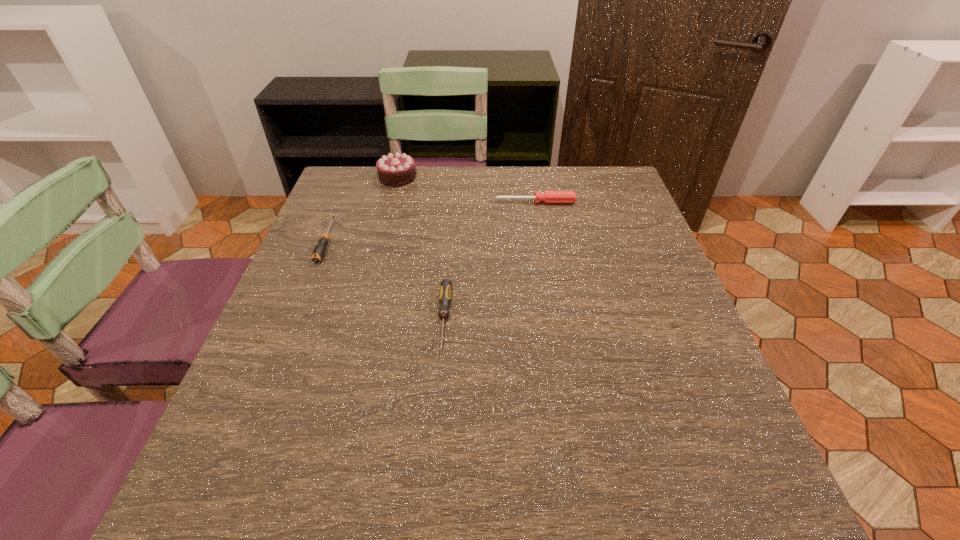
I want to click on chocolate cake, so click(394, 170).

Locate an element on the screen. This screenshot has height=540, width=960. the tallest object is located at coordinates (394, 170).

Find the location of a particular element. This screenshot has width=960, height=540. the rightmost screwdriver is located at coordinates (549, 196).

You are a GUI agent. You are given a task and a screenshot of the screen. Output one action in this format:
    pyautogui.click(x=<x>, y=<y>)
    Task: Click on the rightmost object
    
    Given the screenshot: What is the action you would take?
    pyautogui.click(x=549, y=196)

Locate an element on the screen. The height and width of the screenshot is (540, 960). the second nearest object is located at coordinates (319, 250).

Identify the location of the leftmost object. (319, 250).

Where is `the nearest object`? The image size is (960, 540). the nearest object is located at coordinates (446, 285).

Where is `the second object from right to left`? This screenshot has width=960, height=540. the second object from right to left is located at coordinates (446, 285).

Image resolution: width=960 pixels, height=540 pixels. Identify the location of vacant area located on the right of the farthest object. (491, 177).

At what (x,y) coordinates should I click in order to perform the action: click on free spot located 0.170m on the back of the rightmost object. Please return your answer as a coordinate pair (x, y). Looking at the image, I should click on (531, 168).